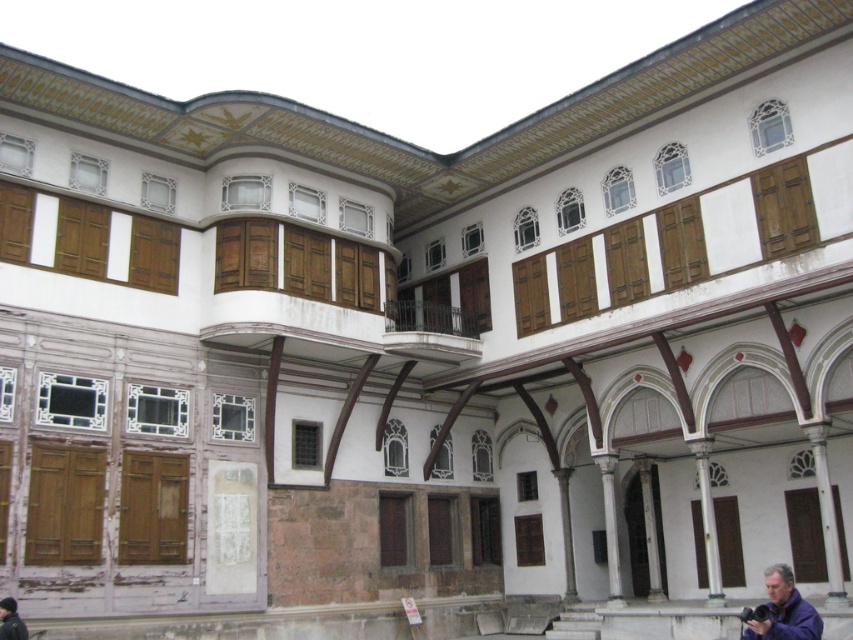
You are an interior designer planning to place a large sofa in a room. You notice the purple fabric at lower right and the dark blue fabric at lower left. Which fabric area is big enough to accommodate the sofa?

The purple fabric at lower right is larger in size than dark blue fabric at lower left, so the purple fabric at lower right has enough space to accommodate the sofa.

You are a painter standing at the center of the building looking towards the front entrance. You need to move your painting supplies from the purple fabric at lower right to the dark blue fabric at lower left. Considering the space between them, will you be able to carry them without any obstacles?

The distance between the purple fabric at lower right and dark blue fabric at lower left is 26.71 meters. Since there are no obstacles mentioned in the scene description, you can carry the supplies without any issues.

You are standing in front of the building and notice two fabrics displayed on either side of the entrance. The purple fabric at lower right and the dark blue fabric at lower left. Which fabric is taller?

The purple fabric at lower right is much taller than the dark blue fabric at lower left.